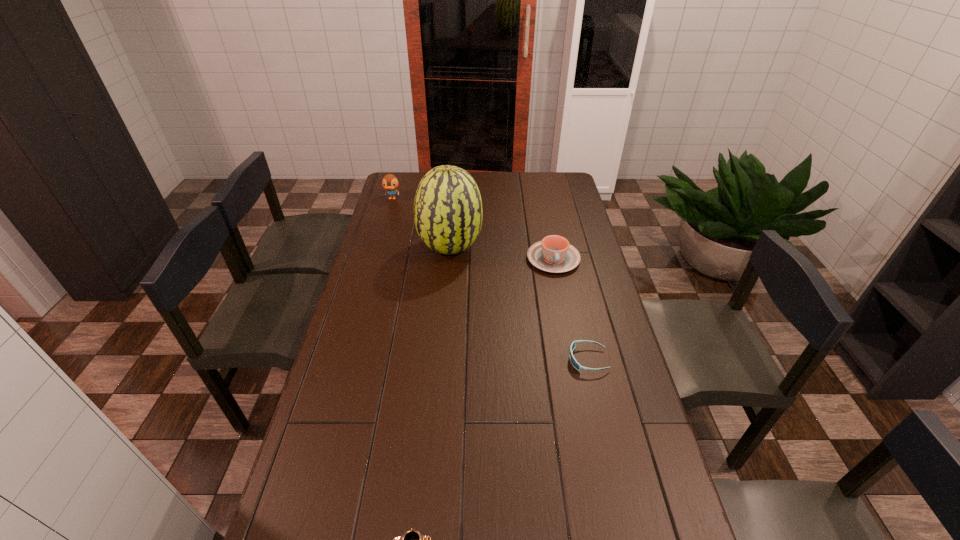
Find the location of a particular element. free space between the chinaware and the tallest object is located at coordinates (502, 254).

Image resolution: width=960 pixels, height=540 pixels. In order to click on free space between the third shortest object and the watermelon in this screenshot , I will do `click(502, 254)`.

Identify the location of object identified as the third closest to the watch. Image resolution: width=960 pixels, height=540 pixels. (554, 254).

Point out which object is positioned as the nearest to the tallest object. Please provide its 2D coordinates. Your answer should be formatted as a tuple, i.e. [(x, y)], where the tuple contains the x and y coordinates of a point satisfying the conditions above.

[(554, 254)]

Identify the location of free space in the image that satisfies the following two spatial constraints: 1. on the front-facing side of the tallest object; 2. on the left side of the farthest object. Image resolution: width=960 pixels, height=540 pixels. (377, 249).